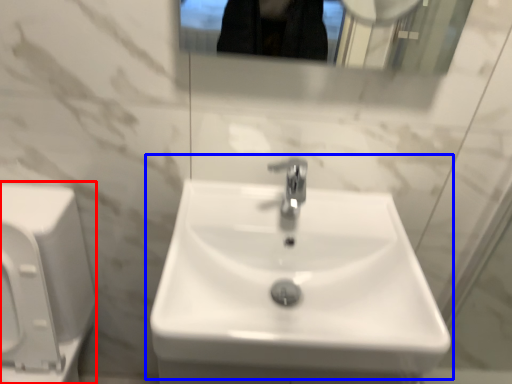
Question: Which point is closer to the camera, porcelain (highlighted by a red box) or sink (highlighted by a blue box)?

Choices:
 (A) porcelain
 (B) sink

Answer: (A)